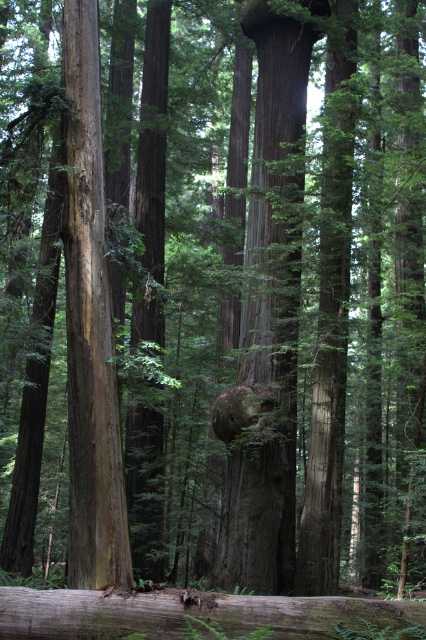
You are standing in the forest and want to take a photo of the smooth brown tree trunk at center. Where should you position yourself to capture it in the frame?

Position yourself so that the camera is aimed at the coordinates point (270,310) to capture the smooth brown tree trunk at center in the frame.